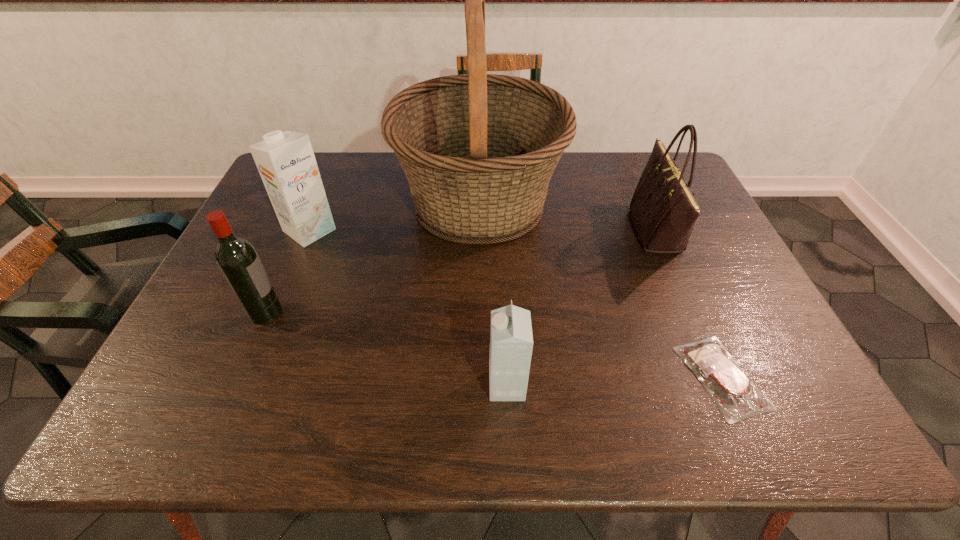
You are a GUI agent. You are given a task and a screenshot of the screen. Output one action in this format:
    pyautogui.click(x=<x>, y=<y>)
    Task: Click on the vacant space that's between the fifth tallest object and the shortest object
    
    Given the screenshot: What is the action you would take?
    pyautogui.click(x=614, y=382)

Locate an element on the screen. free space between the right carton and the taller carton is located at coordinates (408, 308).

You are a GUI agent. You are given a task and a screenshot of the screen. Output one action in this format:
    pyautogui.click(x=<x>, y=<y>)
    Task: Click on the vacant point located between the handbag and the shortest object
    The height and width of the screenshot is (540, 960).
    Given the screenshot: What is the action you would take?
    pyautogui.click(x=689, y=304)

Image resolution: width=960 pixels, height=540 pixels. What are the coordinates of `empty space that is in between the left carton and the shortest object` in the screenshot? It's located at (516, 304).

You are a GUI agent. You are given a task and a screenshot of the screen. Output one action in this format:
    pyautogui.click(x=<x>, y=<y>)
    Task: Click on the free space between the taller carton and the tallest object
    
    Given the screenshot: What is the action you would take?
    pyautogui.click(x=395, y=217)

Identify the location of vacant area that lies between the handbag and the steak. The width and height of the screenshot is (960, 540). (689, 304).

Locate an element on the screen. The height and width of the screenshot is (540, 960). vacant space that is in between the wine bottle and the basket is located at coordinates (372, 258).

Find the location of a particular element. free space between the taller carton and the steak is located at coordinates point(516,304).

Identify the location of object identified as the second closest to the right carton. The image size is (960, 540). (478, 150).

Choose which object is the second nearest neighbor to the tallest object. Please provide its 2D coordinates. Your answer should be formatted as a tuple, i.e. [(x, y)], where the tuple contains the x and y coordinates of a point satisfying the conditions above.

[(663, 210)]